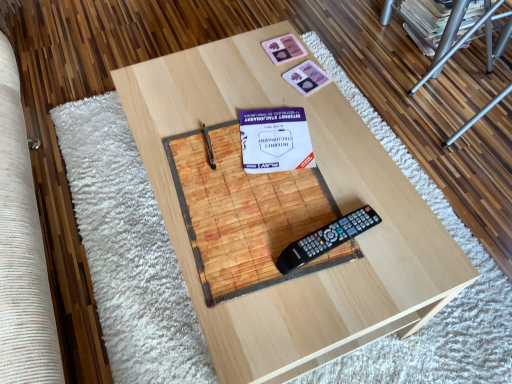
The width and height of the screenshot is (512, 384). Identify the location of vacant space that is in between white paper at center and pink matte coaster at upper center, arranged as the 1th square when viewed from the top. click(x=276, y=92).